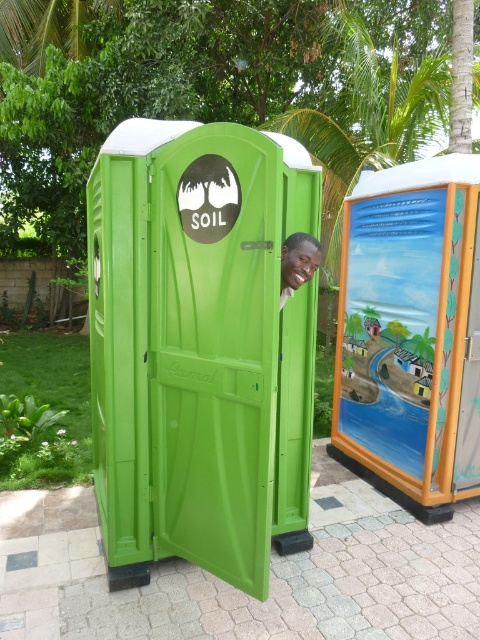
Question: Is green plastic porta-potty at center wider than smooth green door at center?

Choices:
 (A) yes
 (B) no

Answer: (A)

Question: Is green plastic porta-potty at center to the left of smooth green door at center from the viewer's perspective?

Choices:
 (A) no
 (B) yes

Answer: (B)

Question: Does green plastic porta-potty at center come in front of smooth green door at center?

Choices:
 (A) no
 (B) yes

Answer: (B)

Question: Which of the following is the closest to the observer?

Choices:
 (A) green plastic porta-potty at center
 (B) smooth green door at center

Answer: (A)